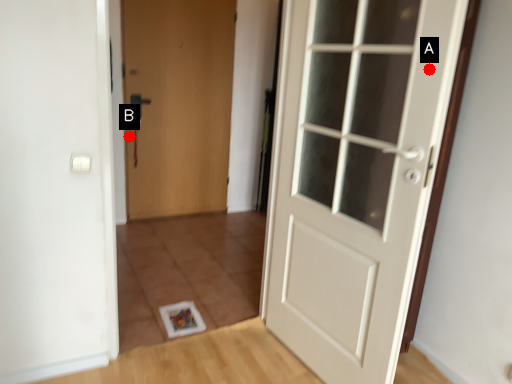
Question: Two points are circled on the image, labeled by A and B beside each circle. Which point appears closest to the camera in this image?

Choices:
 (A) A is closer
 (B) B is closer

Answer: (A)